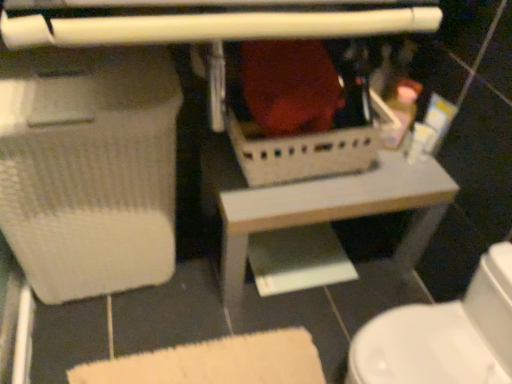
Where is `free point below white plastic basket at center (from a real-world perspective)`? free point below white plastic basket at center (from a real-world perspective) is located at coordinates (302, 253).